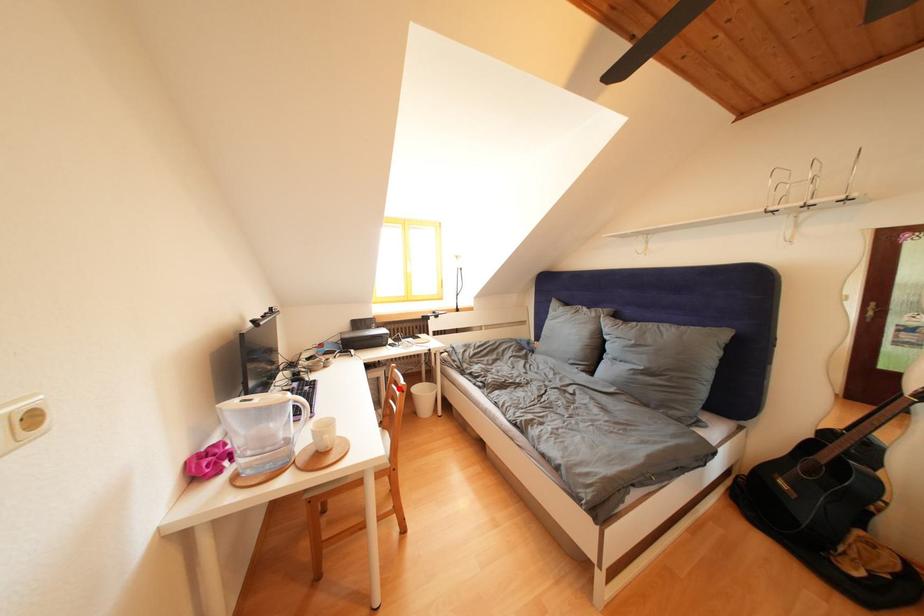
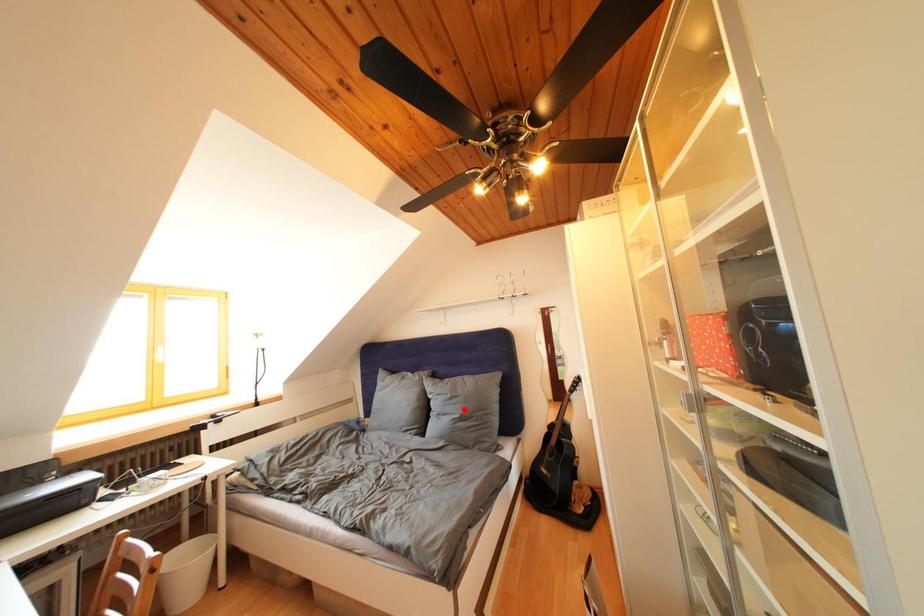
I am providing you with two images of the same scene from different viewpoints. A red point is marked on the first image and another point is marked on the second image. Is the red point in image1 aligned with the point shown in image2?

No